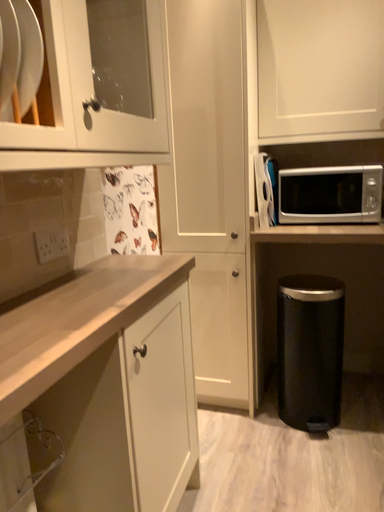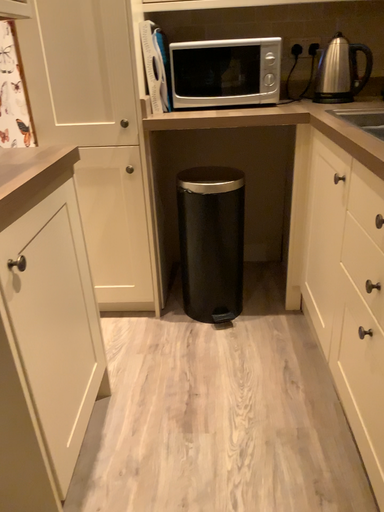
Question: How did the camera likely rotate when shooting the video?

Choices:
 (A) rotated left
 (B) rotated right

Answer: (B)